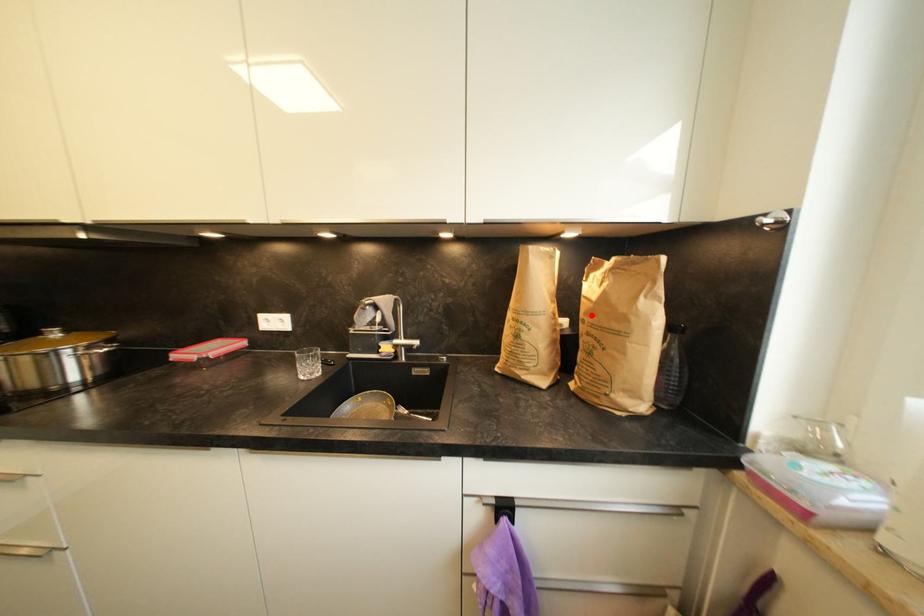
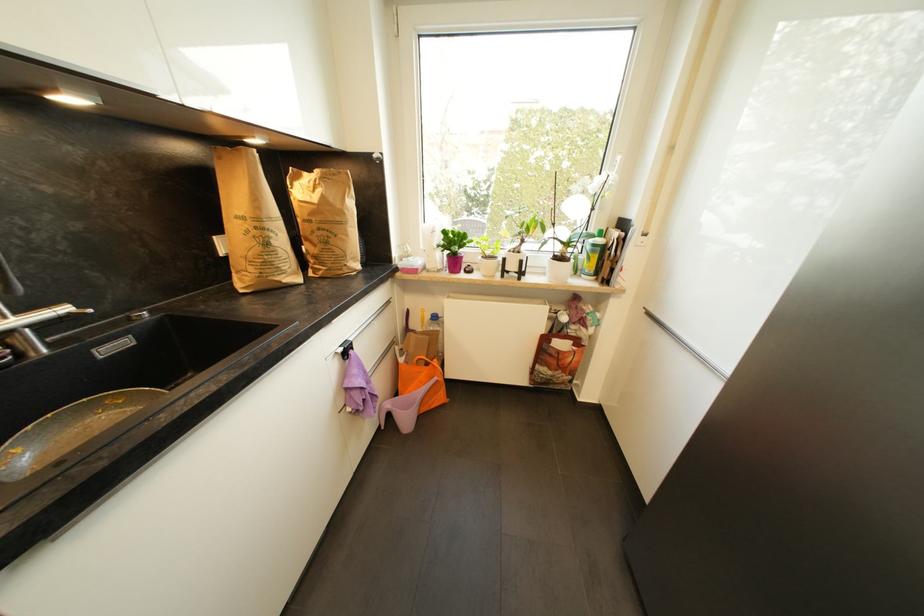
Where in the second image is the point corresponding to the highlighted location from the first image?

(317, 216)